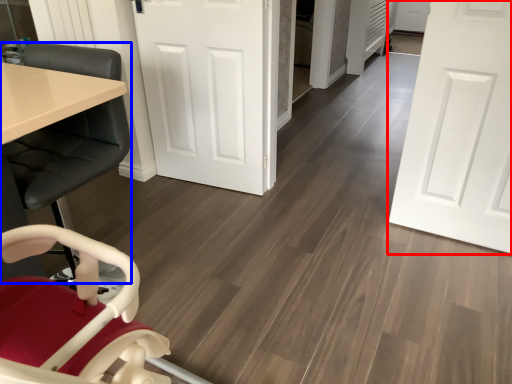
Question: Which point is further to the camera, door (highlighted by a red box) or chair (highlighted by a blue box)?

Choices:
 (A) door
 (B) chair

Answer: (A)